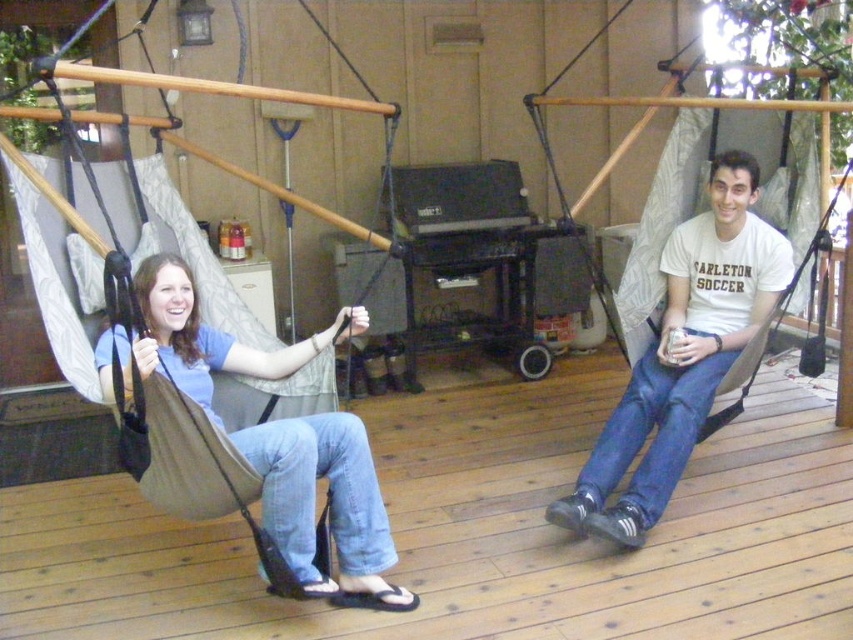
Between wooden deck at center and white cotton t-shirt at center, which one appears on the right side from the viewer's perspective?

From the viewer's perspective, white cotton t-shirt at center appears more on the right side.

Is wooden deck at center thinner than white cotton t-shirt at center?

No, wooden deck at center is not thinner than white cotton t-shirt at center.

This screenshot has height=640, width=853. I want to click on wooden deck at center, so click(x=477, y=534).

Does wooden deck at center have a smaller size compared to matte beige hammock at left?

Incorrect, wooden deck at center is not smaller in size than matte beige hammock at left.

Is wooden deck at center taller than matte beige hammock at left?

Incorrect, wooden deck at center's height is not larger of matte beige hammock at left's.

Looking at this image, measure the distance between point (180,620) and camera.

Point (180,620) is 8.27 feet away from camera.

The image size is (853, 640). I want to click on wooden deck at center, so click(x=477, y=534).

Does white cotton t-shirt at center appear over matte beige hammock at left?

Yes, white cotton t-shirt at center is above matte beige hammock at left.

Can you confirm if white cotton t-shirt at center is thinner than matte beige hammock at left?

No.

Image resolution: width=853 pixels, height=640 pixels. What do you see at coordinates (683, 355) in the screenshot? I see `white cotton t-shirt at center` at bounding box center [683, 355].

The height and width of the screenshot is (640, 853). In order to click on white cotton t-shirt at center in this screenshot , I will do `click(683, 355)`.